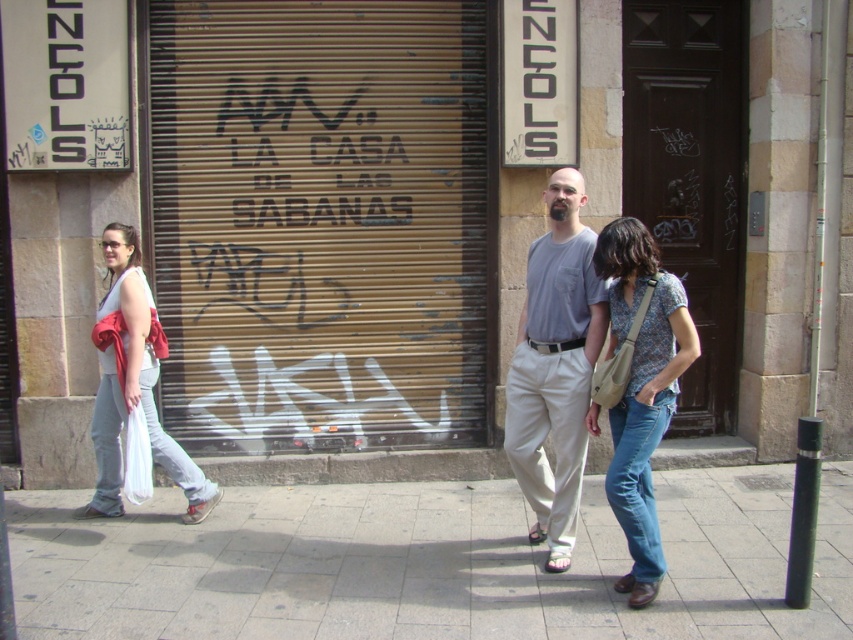
What is the exact coordinate of the gold metallic garage door at center?

The gold metallic garage door at center is located at point (321, 221).

You are standing at point (x=654, y=70) and want to walk to the other side of the street. There is a car parked 6.23 meters away from you. Will you have to walk past the car to reach the other side?

The distance between you and the car is 6.23 meters, so you will have to walk past the car to reach the other side of the street.

You are a delivery person with a box that is 1.2 meters long. You need to place it between the gold metallic garage door at center and the light blue jeans at left. Is there enough space?

The gold metallic garage door at center and light blue jeans at left are 1.07 meters apart. Since the box is 1.2 meters long, it won not fit between them.